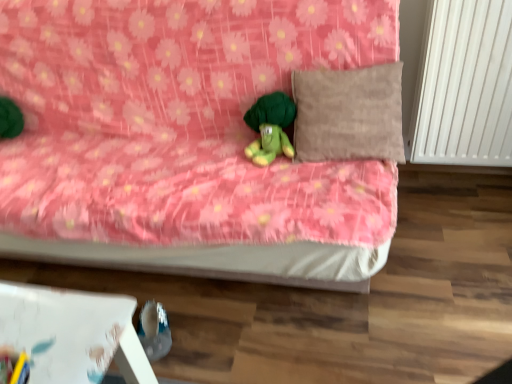
Question: Is green plush turtle at center inside the boundaries of suede-like beige pillow at upper right, or outside?

Choices:
 (A) outside
 (B) inside

Answer: (A)

Question: In terms of size, does green plush turtle at center appear bigger or smaller than suede-like beige pillow at upper right?

Choices:
 (A) big
 (B) small

Answer: (B)

Question: Which object is the closest to the pink floral fabric bed at center?

Choices:
 (A) green plush turtle at center
 (B) suede-like beige pillow at upper right
 (C) white smooth radiator at right

Answer: (B)

Question: Estimate the real-world distances between objects in this image. Which object is closer to the pink floral fabric bed at center?

Choices:
 (A) green plush turtle at center
 (B) white smooth radiator at right
 (C) suede-like beige pillow at upper right

Answer: (C)